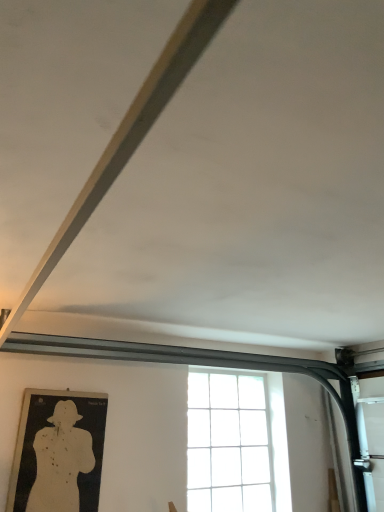
Image resolution: width=384 pixels, height=512 pixels. What do you see at coordinates (60, 461) in the screenshot?
I see `white paper target at lower left` at bounding box center [60, 461].

Locate an element on the screen. Image resolution: width=384 pixels, height=512 pixels. white paper target at lower left is located at coordinates (60, 461).

This screenshot has width=384, height=512. Describe the element at coordinates (236, 444) in the screenshot. I see `clear glass window at center` at that location.

Identify the location of clear glass window at center. (236, 444).

Consider the image. Measure the distance between clear glass window at center and camera.

The depth of clear glass window at center is 9.24 feet.

Locate an element on the screen. white paper target at lower left is located at coordinates [60, 461].

Between clear glass window at center and white paper target at lower left, which one appears on the right side from the viewer's perspective?

clear glass window at center.

Between clear glass window at center and white paper target at lower left, which one is positioned behind?

clear glass window at center is further away from the camera.

Does point (267, 387) come farther from viewer compared to point (48, 507)?

Yes, point (267, 387) is behind point (48, 507).

From the image's perspective, does clear glass window at center appear higher than white paper target at lower left?

No, from the image's perspective, clear glass window at center is not on top of white paper target at lower left.

From a real-world perspective, is clear glass window at center physically below white paper target at lower left?

Incorrect, from a real-world perspective, clear glass window at center is higher than white paper target at lower left.

Between clear glass window at center and white paper target at lower left, which one has smaller width?

With smaller width is white paper target at lower left.

Between clear glass window at center and white paper target at lower left, which one has less height?

With less height is white paper target at lower left.

Based on the photo, considering the relative sizes of clear glass window at center and white paper target at lower left in the image provided, is clear glass window at center smaller than white paper target at lower left?

Incorrect, clear glass window at center is not smaller in size than white paper target at lower left.

Is clear glass window at center located outside white paper target at lower left?

Indeed, clear glass window at center is completely outside white paper target at lower left.

Are clear glass window at center and white paper target at lower left making contact?

No, clear glass window at center is not making contact with white paper target at lower left.

Looking at this image, is clear glass window at center looking in the opposite direction of white paper target at lower left?

No, clear glass window at center is not facing away from white paper target at lower left.

What's the angular difference between clear glass window at center and white paper target at lower left's facing directions?

The angular difference between clear glass window at center and white paper target at lower left is 0.00398 degrees.

How much distance is there between clear glass window at center and white paper target at lower left?

A distance of 1.10 meters exists between clear glass window at center and white paper target at lower left.

Find the location of `window behind the white paper target at lower left`. window behind the white paper target at lower left is located at coordinates 236,444.

Considering the relative positions of white paper target at lower left and clear glass window at center in the image provided, is white paper target at lower left to the left of clear glass window at center from the viewer's perspective?

Yes.

Which object is closer to the camera taking this photo, white paper target at lower left or clear glass window at center?

white paper target at lower left is in front.

Which is closer to the camera, [58,470] or [247,441]?

The point [58,470] is in front.

From the image's perspective, does white paper target at lower left appear higher than clear glass window at center?

Yes, from the image's perspective, white paper target at lower left is above clear glass window at center.

From a real-world perspective, which is physically above, white paper target at lower left or clear glass window at center?

clear glass window at center, from a real-world perspective.

In the scene shown: Considering the sizes of objects white paper target at lower left and clear glass window at center in the image provided, who is wider, white paper target at lower left or clear glass window at center?

Wider between the two is clear glass window at center.

Between white paper target at lower left and clear glass window at center, which one has less height?

Standing shorter between the two is white paper target at lower left.

Does white paper target at lower left have a larger size compared to clear glass window at center?

Incorrect, white paper target at lower left is not larger than clear glass window at center.

Is white paper target at lower left surrounding clear glass window at center?

No, clear glass window at center is not surrounded by white paper target at lower left.

Is there a large distance between white paper target at lower left and clear glass window at center?

white paper target at lower left is far away from clear glass window at center.

Is white paper target at lower left positioned with its back to clear glass window at center?

No, clear glass window at center is not at the back of white paper target at lower left.

How many degrees apart are the facing directions of white paper target at lower left and clear glass window at center?

The angular difference between white paper target at lower left and clear glass window at center is 0.00398 degrees.

How far apart are white paper target at lower left and clear glass window at center?

white paper target at lower left is 3.62 feet from clear glass window at center.

You are a GUI agent. You are given a task and a screenshot of the screen. Output one action in this format:
    pyautogui.click(x=<x>, y=<y>)
    Task: Click on the window located above the white paper target at lower left (from a real-world perspective)
    Image resolution: width=384 pixels, height=512 pixels.
    Given the screenshot: What is the action you would take?
    click(236, 444)

Locate an element on the screen. window that is on the right side of white paper target at lower left is located at coordinates (236, 444).

Locate an element on the screen. Image resolution: width=384 pixels, height=512 pixels. window below the white paper target at lower left (from the image's perspective) is located at coordinates (236, 444).